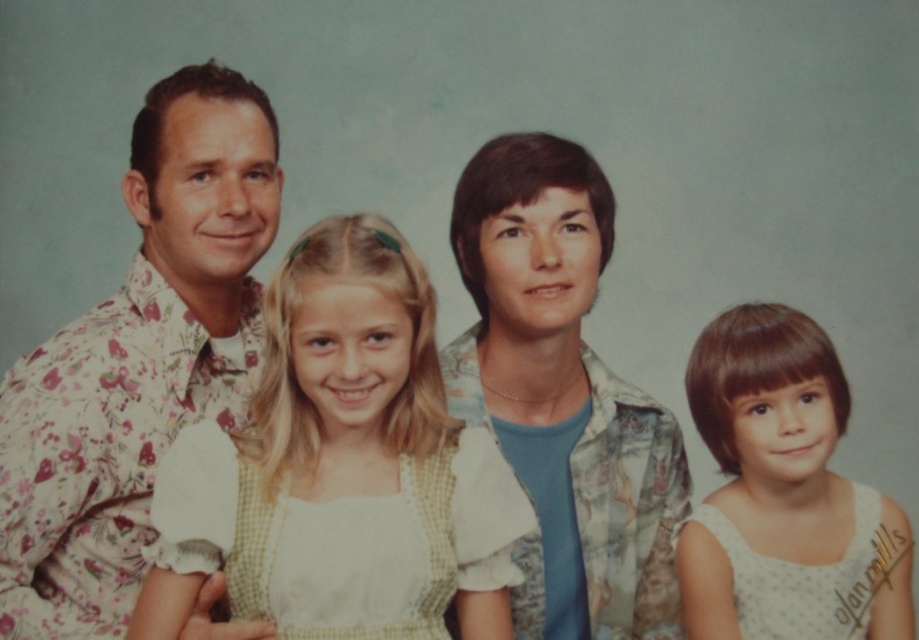
Does camouflage-patterned shirt at center lie behind white checkered dress at center?

Yes, camouflage-patterned shirt at center is behind white checkered dress at center.

Who is positioned more to the left, camouflage-patterned shirt at center or white checkered dress at center?

white checkered dress at center is more to the left.

Locate an element on the screen. The width and height of the screenshot is (919, 640). camouflage-patterned shirt at center is located at coordinates (562, 396).

Is the position of floral-patterned shirt at left more distant than that of white dotted dress at lower right?

That is False.

Can you confirm if floral-patterned shirt at left is positioned to the right of white dotted dress at lower right?

No, floral-patterned shirt at left is not to the right of white dotted dress at lower right.

This screenshot has height=640, width=919. In order to click on floral-patterned shirt at left in this screenshot , I will do `click(137, 358)`.

You are a GUI agent. You are given a task and a screenshot of the screen. Output one action in this format:
    pyautogui.click(x=<x>, y=<y>)
    Task: Click on the floral-patterned shirt at left
    Image resolution: width=919 pixels, height=640 pixels.
    Given the screenshot: What is the action you would take?
    pyautogui.click(x=137, y=358)

Is floral-patterned shirt at left thinner than white checkered dress at center?

Yes, floral-patterned shirt at left is thinner than white checkered dress at center.

Is floral-patterned shirt at left behind white checkered dress at center?

Yes, it is.

Who is more distant from viewer, (x=50, y=602) or (x=357, y=529)?

The point (x=50, y=602) is behind.

Identify the location of floral-patterned shirt at left. This screenshot has width=919, height=640. (x=137, y=358).